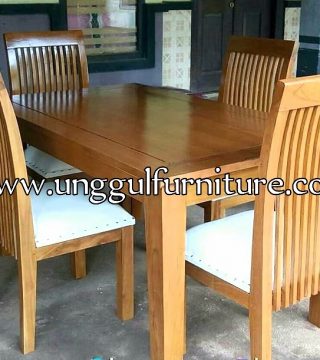
The width and height of the screenshot is (320, 360). What are the coordinates of `table` in the screenshot? It's located at (180, 146).